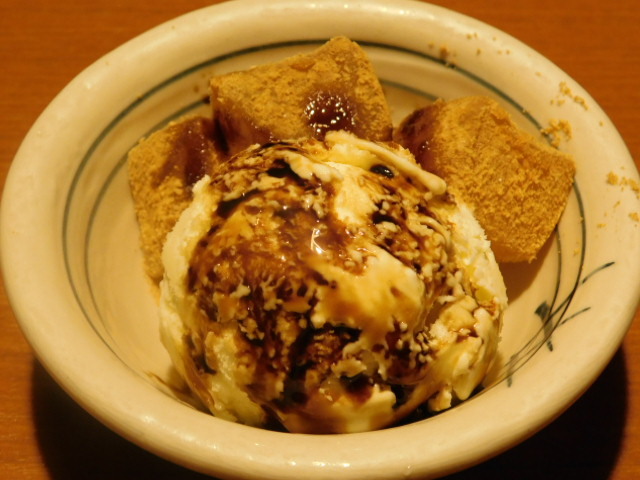
You are a GUI agent. You are given a task and a screenshot of the screen. Output one action in this format:
    pyautogui.click(x=<x>, y=<y>)
    Task: Click on the wood surface
    This screenshot has width=640, height=480.
    Given the screenshot: What is the action you would take?
    pyautogui.click(x=637, y=460)